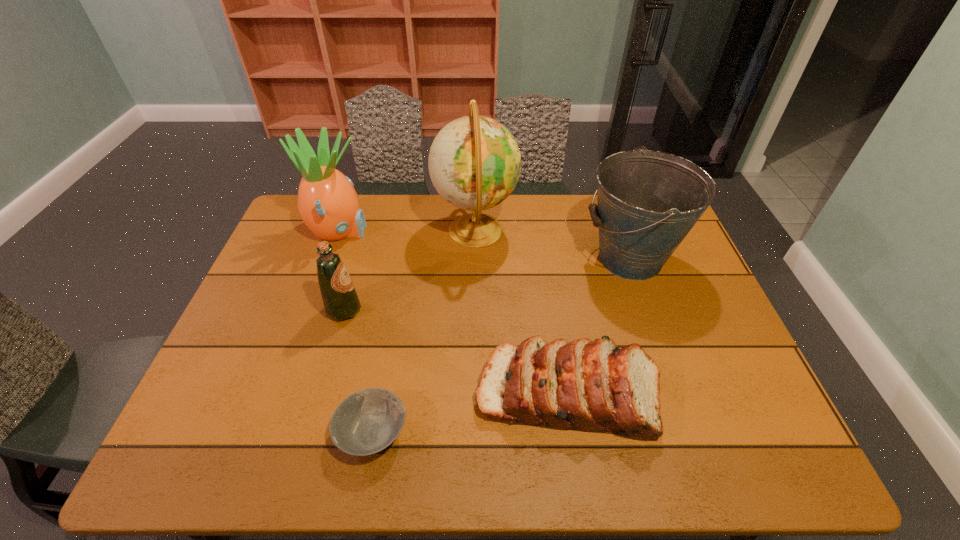
Where is `bowl present at the near edge`? The image size is (960, 540). bowl present at the near edge is located at coordinates (366, 422).

This screenshot has height=540, width=960. In order to click on object present at the left edge in this screenshot , I will do `click(327, 202)`.

I want to click on object that is positioned at the right edge, so click(648, 201).

Identify the location of object at the far left corner. (327, 202).

Find the location of `object that is at the far right corner`. object that is at the far right corner is located at coordinates (648, 201).

Locate an element on the screen. This screenshot has width=960, height=540. free space at the far edge of the desktop is located at coordinates (409, 218).

I want to click on free space at the near edge of the desktop, so click(x=659, y=453).

I want to click on free space at the left edge, so click(199, 403).

This screenshot has height=540, width=960. Identify the location of free space at the right edge. (729, 362).

I want to click on blank space at the near right corner, so click(x=763, y=442).